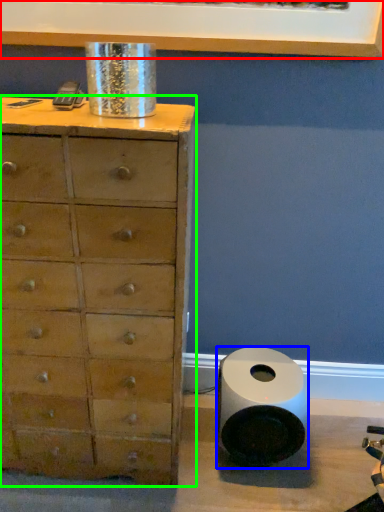
Question: Based on their relative distances, which object is nearer to picture frame (highlighted by a red box)? Choose from speaker (highlighted by a blue box) and chest of drawers (highlighted by a green box).

Choices:
 (A) speaker
 (B) chest of drawers

Answer: (B)